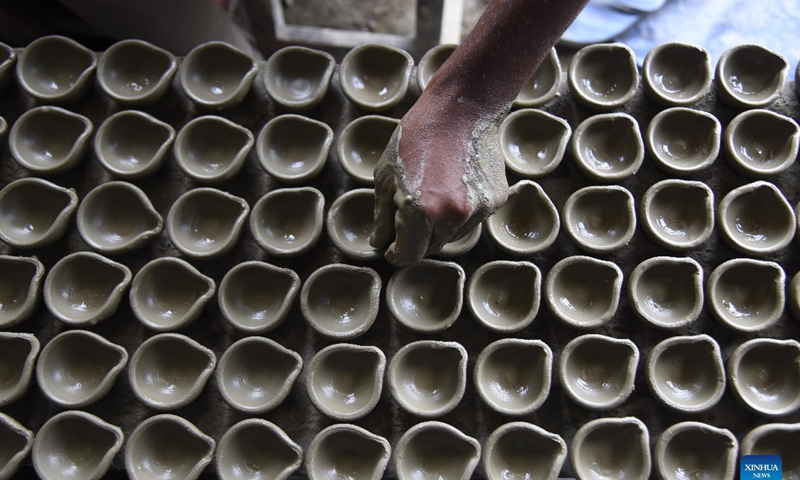
I want to click on cup, so click(686, 461).